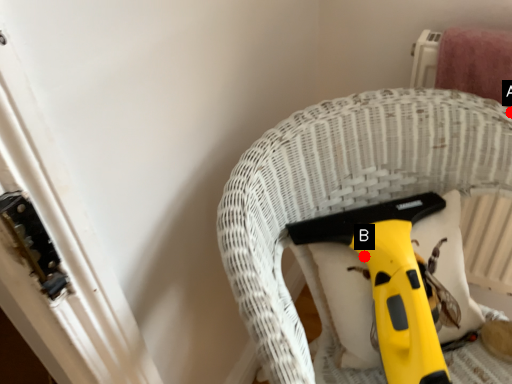
Question: Two points are circled on the image, labeled by A and B beside each circle. Which point is farther from the camera taking this photo?

Choices:
 (A) A is further
 (B) B is further

Answer: (A)